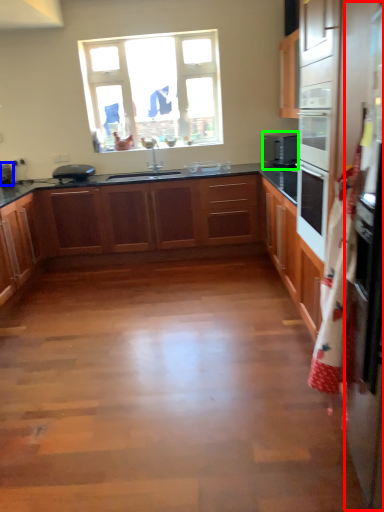
Question: Which is nearer to the fridge (highlighted by a red box)? appliance (highlighted by a blue box) or home appliance (highlighted by a green box).

Choices:
 (A) appliance
 (B) home appliance

Answer: (B)